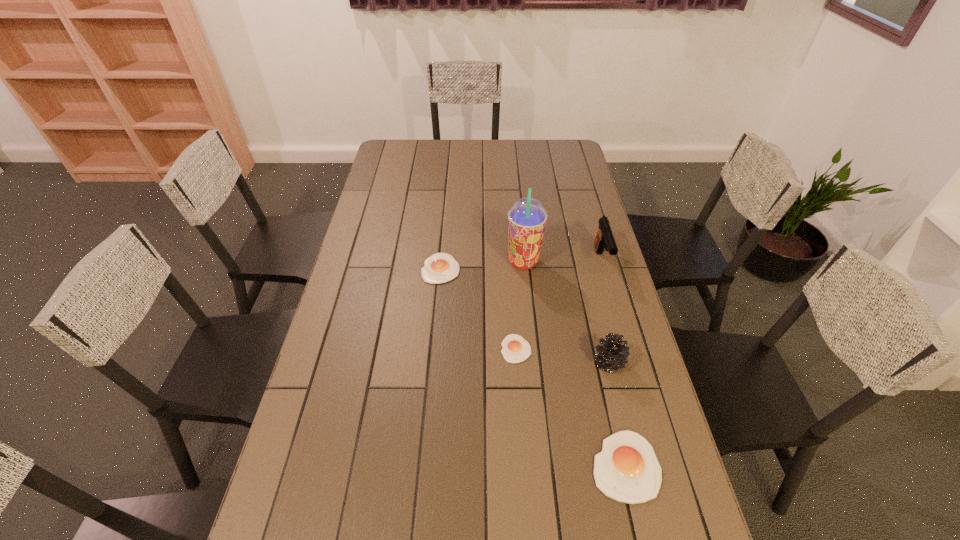
Where is `free space for a new egg yolk on the left`? This screenshot has height=540, width=960. free space for a new egg yolk on the left is located at coordinates (386, 210).